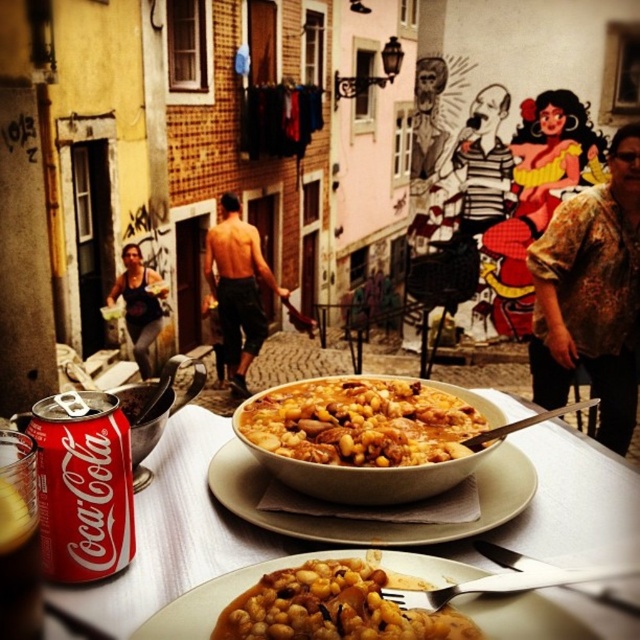
Who is positioned more to the left, printed silk blouse at right or golden brown stew at center?

From the viewer's perspective, golden brown stew at center appears more on the left side.

Is point (536, 316) farther from camera compared to point (445, 452)?

Yes, it is.

The image size is (640, 640). What do you see at coordinates (592, 296) in the screenshot? I see `printed silk blouse at right` at bounding box center [592, 296].

Find the location of a particular element. printed silk blouse at right is located at coordinates (592, 296).

Can you confirm if coca-cola can at lower left is shorter than matte black tank top at center?

Correct, coca-cola can at lower left is not as tall as matte black tank top at center.

Is point (42, 508) closer to camera compared to point (122, 262)?

Yes, point (42, 508) is in front of point (122, 262).

The height and width of the screenshot is (640, 640). Describe the element at coordinates (83, 484) in the screenshot. I see `coca-cola can at lower left` at that location.

The width and height of the screenshot is (640, 640). What are the coordinates of `coca-cola can at lower left` in the screenshot? It's located at (83, 484).

In the scene shown: Who is positioned more to the right, red matte coca-cola can at lower left or matte black tank top at center?

Result: From the viewer's perspective, red matte coca-cola can at lower left appears more on the right side.

Does point (184, 536) come farther from viewer compared to point (144, 301)?

That is False.

Locate an element on the screen. The width and height of the screenshot is (640, 640). red matte coca-cola can at lower left is located at coordinates (176, 532).